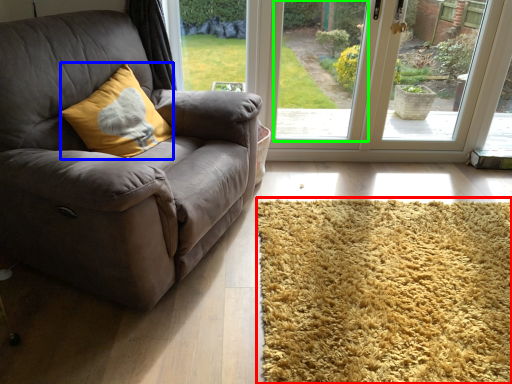
Question: Which is nearer to the mat (highlighted by a red box)? throw pillow (highlighted by a blue box) or window screen (highlighted by a green box).

Choices:
 (A) throw pillow
 (B) window screen

Answer: (A)